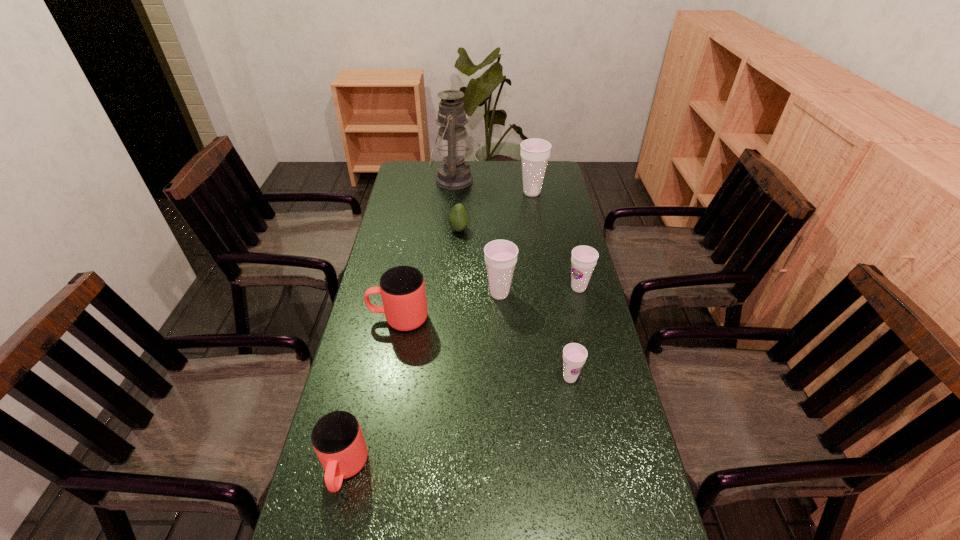
Locate an element on the screen. oil lamp present at the far edge is located at coordinates (454, 173).

Identify the location of cup at the far edge. (535, 153).

Find the location of a particular element. The height and width of the screenshot is (540, 960). oil lamp that is positioned at the left edge is located at coordinates (454, 173).

Where is `object that is at the far left corner`? This screenshot has width=960, height=540. object that is at the far left corner is located at coordinates (454, 173).

Where is `object present at the far right corner`? This screenshot has width=960, height=540. object present at the far right corner is located at coordinates (535, 153).

Locate an element on the screen. The width and height of the screenshot is (960, 540). free point at the far edge is located at coordinates (503, 174).

The width and height of the screenshot is (960, 540). Find the location of `vacant space at the left edge`. vacant space at the left edge is located at coordinates (372, 301).

The image size is (960, 540). In the image, there is a desktop. Identify the location of vacant space at the right edge. (560, 218).

Identify the location of free space at the far left corner. The width and height of the screenshot is (960, 540). (407, 164).

In order to click on vacant space that's between the green avocado and the third biggest purple cup in this screenshot , I will do `click(518, 259)`.